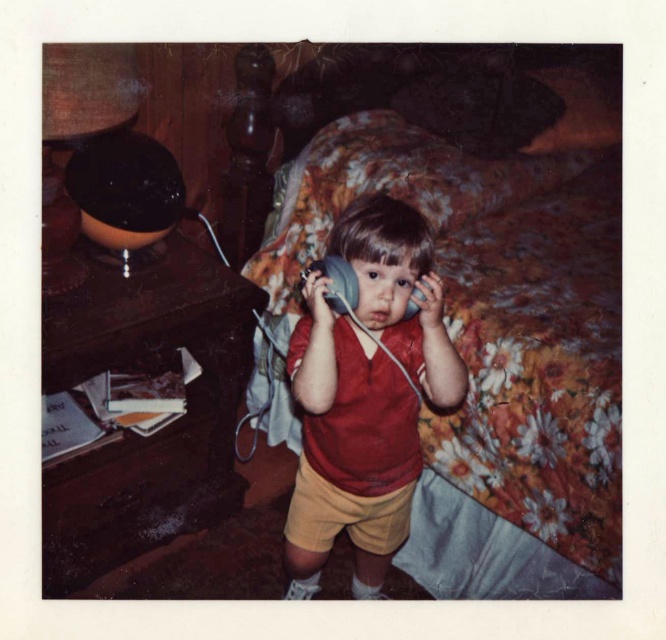
You are standing at the position of point (410, 451) and want to move to the position of point (593, 64). Is the path between these two points clear?

Point (593, 64) is behind point (410, 451), so the path between them is clear as there are no obstacles mentioned in the scene description.

You are a tailor measuring the height of objects in the room. You need to determine which object is taller between the floral fabric bed at center and the matte red shirt at center. Based on the scene, which one is taller?

The floral fabric bed at center is taller than the matte red shirt at center according to the description.